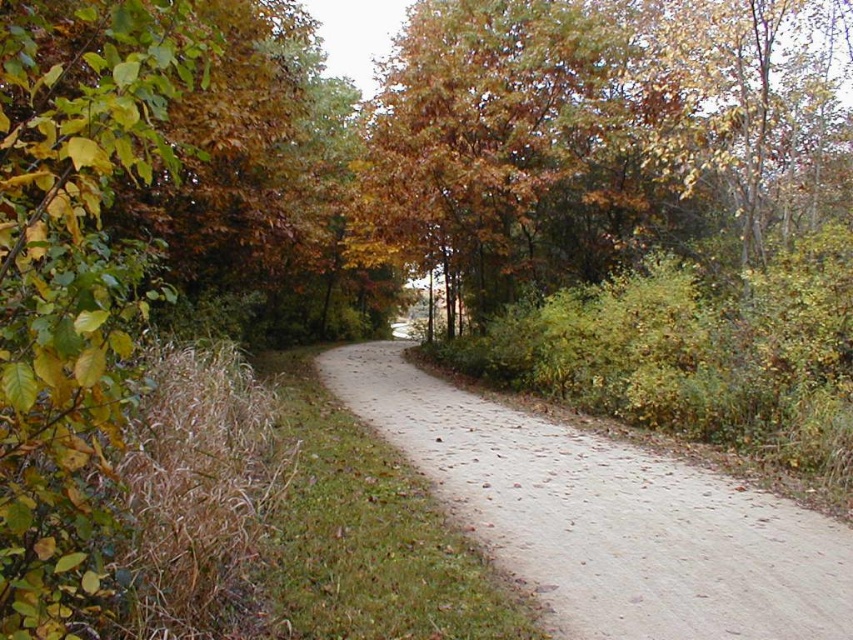
Question: Is dirt/gravel path at center in front of autumn leaves at upper center?

Choices:
 (A) yes
 (B) no

Answer: (A)

Question: Which point is closer to the camera taking this photo?

Choices:
 (A) (549, 531)
 (B) (398, 228)

Answer: (A)

Question: Is dirt/gravel path at center smaller than autumn leaves at upper center?

Choices:
 (A) no
 (B) yes

Answer: (B)

Question: Among these objects, which one is nearest to the camera?

Choices:
 (A) dirt/gravel path at center
 (B) autumn leaves at upper center

Answer: (A)

Question: Which of the following is the farthest from the observer?

Choices:
 (A) dirt/gravel path at center
 (B) autumn leaves at upper center

Answer: (B)

Question: Is dirt/gravel path at center below autumn leaves at upper center?

Choices:
 (A) yes
 (B) no

Answer: (A)